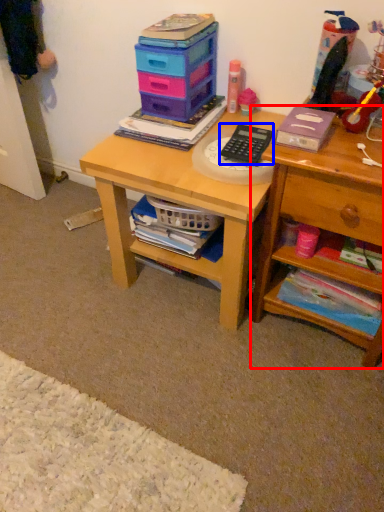
Question: Among these objects, which one is nearest to the camera, shelf (highlighted by a red box) or calculator (highlighted by a blue box)?

Choices:
 (A) shelf
 (B) calculator

Answer: (A)